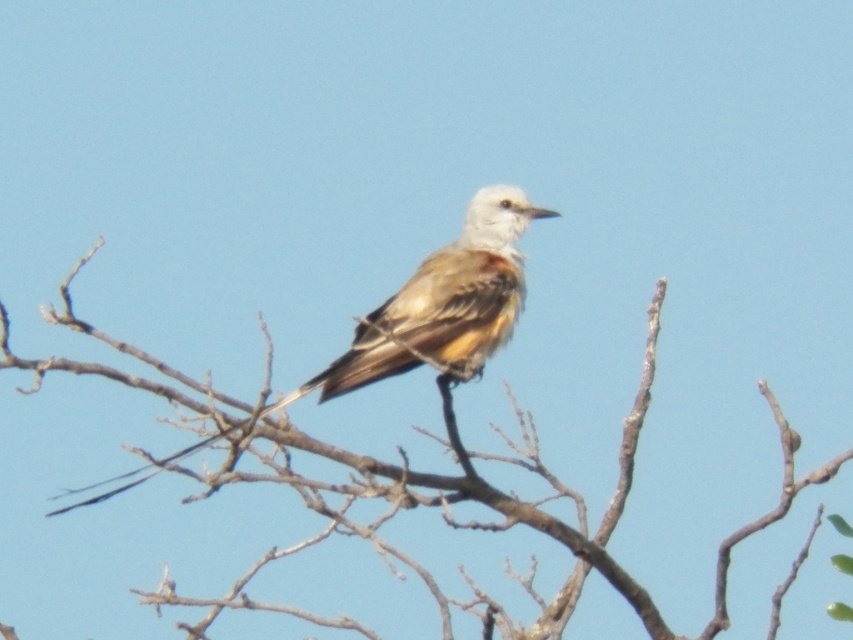
You are a birdwatcher observing the brown feathered bird at center perched on the brown textured branch at center. Which object is bigger in size?

The brown textured branch at center is larger in size than the brown feathered bird at center.

You are a photographer aiming to capture the brown feathered bird at center. You notice the brown textured branch at center is blocking part of the bird. Can you adjust your position to get a clear shot without the branch in the way?

The brown textured branch at center is in front of the brown feathered bird at center, so moving your position to the side or slightly behind might allow you to capture the bird without the branch blocking it.

You are an ornithologist observing a bird in a natural setting. You see the brown feathered bird at center and the brown textured branch at center. Which object is taller?

The brown textured branch at center is taller than the brown feathered bird at center.